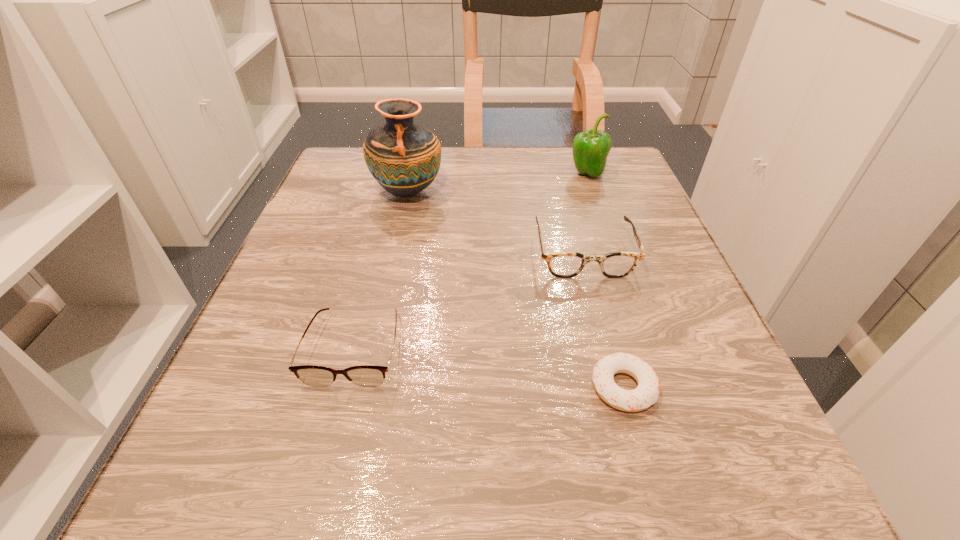
At what (x,y) coordinates should I click in order to perform the action: click on object that is positioned at the far right corner. Please return your answer as a coordinate pair (x, y). Image resolution: width=960 pixels, height=540 pixels. Looking at the image, I should click on (590, 148).

The height and width of the screenshot is (540, 960). In the image, there is a desktop. Identify the location of vacant space at the far edge. (458, 199).

In the image, there is a desktop. Where is `free region at the near edge`? This screenshot has height=540, width=960. free region at the near edge is located at coordinates (540, 504).

You are a GUI agent. You are given a task and a screenshot of the screen. Output one action in this format:
    pyautogui.click(x=<x>, y=<y>)
    Task: Click on the free point at the left edge
    
    Given the screenshot: What is the action you would take?
    pyautogui.click(x=322, y=292)

Find the location of a particular element. This screenshot has width=960, height=540. vacant space at the right edge is located at coordinates (609, 205).

Where is `vacant space at the near left corner of the desktop`? This screenshot has width=960, height=540. vacant space at the near left corner of the desktop is located at coordinates (184, 514).

Identify the location of free space at the far right corner. Image resolution: width=960 pixels, height=540 pixels. (606, 196).

Image resolution: width=960 pixels, height=540 pixels. I want to click on free space at the near right corner of the desktop, so click(686, 463).

This screenshot has height=540, width=960. Identify the location of blank region between the tallest object and the shortest object. (516, 290).

The height and width of the screenshot is (540, 960). I want to click on empty location between the tallest object and the farther spectacles, so click(495, 222).